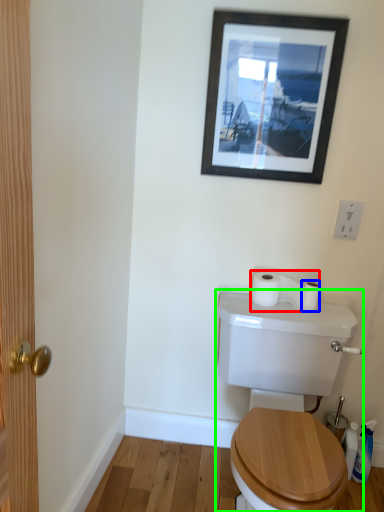
Question: Which object is positioned farthest from toilet paper (highlighted by a red box)? Select from toilet paper (highlighted by a blue box) and toilet (highlighted by a green box).

Choices:
 (A) toilet paper
 (B) toilet

Answer: (B)